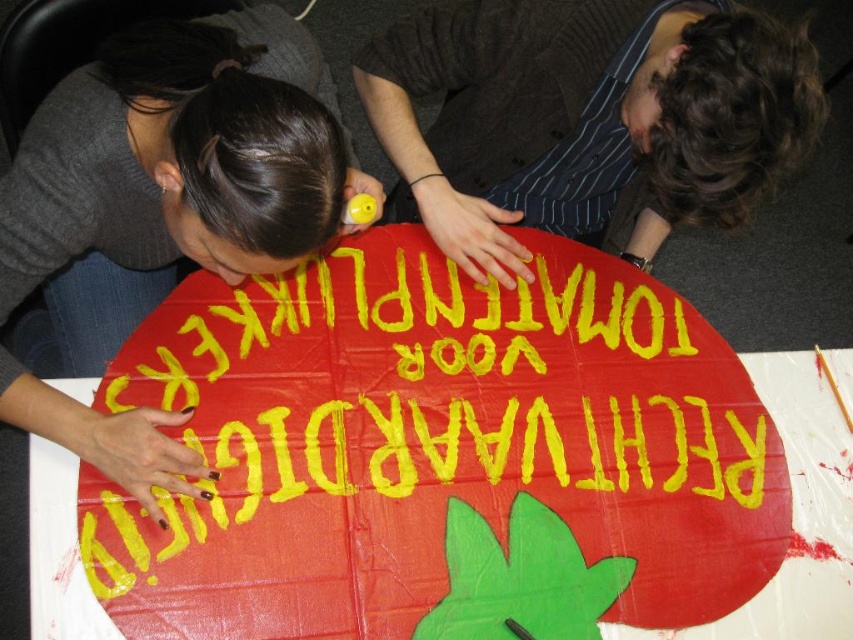
Question: Can you confirm if matte cardboard sign at center is bigger than dark brown striped shirt at upper center?

Choices:
 (A) yes
 (B) no

Answer: (A)

Question: Which point is farther to the camera?

Choices:
 (A) (590, 497)
 (B) (804, 96)

Answer: (A)

Question: Can you confirm if matte cardboard sign at center is positioned to the left of dark brown striped shirt at upper center?

Choices:
 (A) no
 (B) yes

Answer: (B)

Question: In this image, where is matte cardboard sign at center located relative to dark brown striped shirt at upper center?

Choices:
 (A) above
 (B) below

Answer: (B)

Question: Which object is closer to the camera taking this photo?

Choices:
 (A) matte cardboard sign at center
 (B) dark brown striped shirt at upper center

Answer: (B)